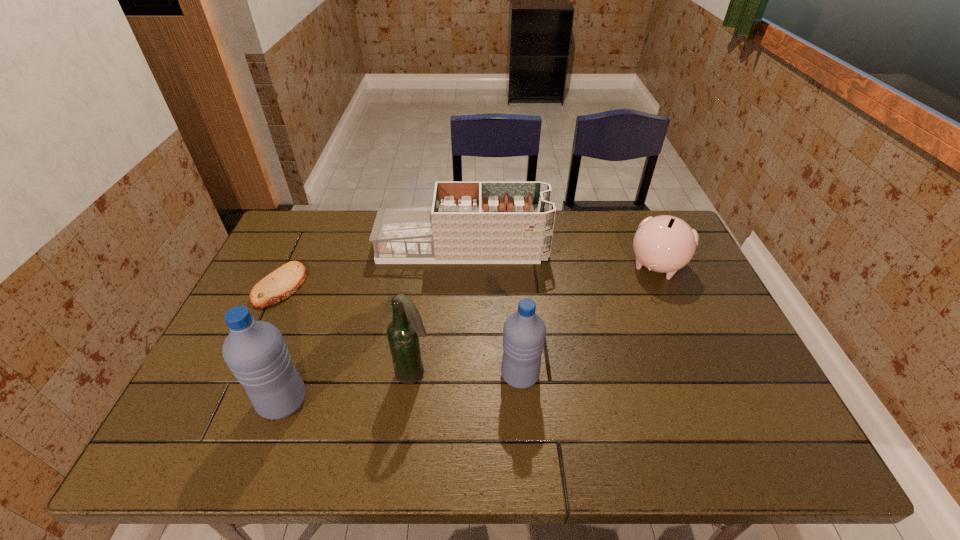
You are a GUI agent. You are given a task and a screenshot of the screen. Output one action in this format:
    pyautogui.click(x=<x>, y=<y>)
    Task: Click on the object situated at the near left corner
    The height and width of the screenshot is (540, 960).
    Given the screenshot: What is the action you would take?
    pyautogui.click(x=255, y=351)

You are a GUI agent. You are given a task and a screenshot of the screen. Output one action in this format:
    pyautogui.click(x=<x>, y=<y>)
    Task: Click on the object at the far right corner
    
    Given the screenshot: What is the action you would take?
    pyautogui.click(x=665, y=244)

This screenshot has width=960, height=540. What are the coordinates of `vacant region at the far edge of the desktop` in the screenshot? It's located at (364, 248).

The width and height of the screenshot is (960, 540). In the image, there is a desktop. What are the coordinates of `vacant space at the near edge` in the screenshot? It's located at (576, 415).

In the image, there is a desktop. Where is `free space at the left edge`? The height and width of the screenshot is (540, 960). free space at the left edge is located at coordinates (299, 306).

Locate an element on the screen. The height and width of the screenshot is (540, 960). free space at the right edge is located at coordinates (653, 285).

Find the location of `free space at the far left corner`. free space at the far left corner is located at coordinates (295, 215).

Where is `vacant area at the near left corner`? vacant area at the near left corner is located at coordinates (219, 407).

The height and width of the screenshot is (540, 960). In order to click on vacant region at the near right corner of the desktop in this screenshot , I will do `click(768, 404)`.

Find the location of a particular element. The image size is (960, 540). unoccupied position between the dollhouse and the shorter water bottle is located at coordinates (492, 312).